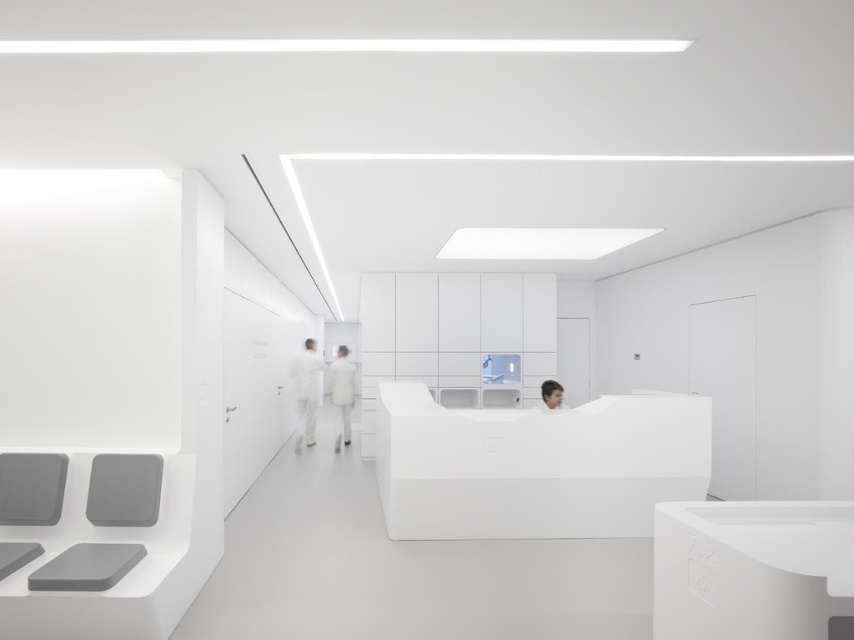
Image resolution: width=854 pixels, height=640 pixels. In order to click on matte gray chair at lower left in this screenshot , I will do `click(124, 490)`.

Can you confirm if matte gray chair at lower left is thinner than white matte/soft fabric person at center?

Yes.

Image resolution: width=854 pixels, height=640 pixels. Describe the element at coordinates (124, 490) in the screenshot. I see `matte gray chair at lower left` at that location.

The height and width of the screenshot is (640, 854). I want to click on matte gray chair at lower left, so click(124, 490).

Can you confirm if white matte/soft fabric person at center is positioned to the right of white matte uniform at center?

Incorrect, white matte/soft fabric person at center is not on the right side of white matte uniform at center.

Does white matte/soft fabric person at center come in front of white matte uniform at center?

That is True.

Measure the distance between white matte/soft fabric person at center and camera.

Result: The distance of white matte/soft fabric person at center from camera is 27.04 feet.

Locate an element on the screen. This screenshot has height=640, width=854. white matte/soft fabric person at center is located at coordinates (306, 392).

Can you confirm if matte gray chair at lower left is shorter than white matte uniform at center?

Correct, matte gray chair at lower left is not as tall as white matte uniform at center.

Between point (106, 454) and point (342, 353), which one is positioned in front?

Positioned in front is point (106, 454).

Locate an element on the screen. This screenshot has width=854, height=640. matte gray chair at lower left is located at coordinates (124, 490).